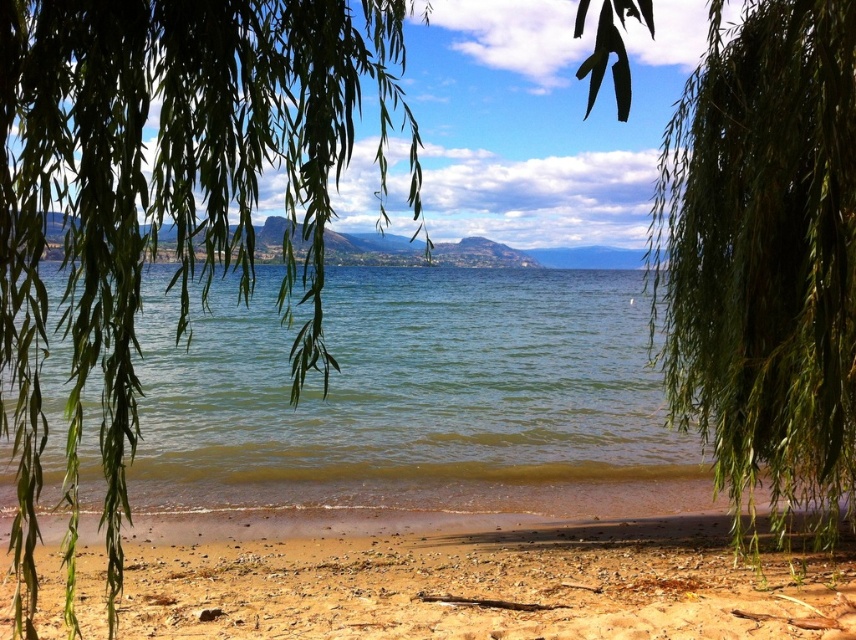
Does green leafy tree at center appear under green leafy branch at center?

No, green leafy tree at center is not below green leafy branch at center.

Who is more forward, (94, 204) or (715, 301)?

Point (94, 204) is in front.

I want to click on green leafy tree at center, so click(x=162, y=196).

Does green leafy branch at center lie behind brown sandy beach at lower center?

No, green leafy branch at center is closer to the viewer.

Is point (785, 163) closer to camera compared to point (681, 564)?

Yes, it is in front of point (681, 564).

What are the coordinates of `green leafy branch at center` in the screenshot? It's located at click(765, 257).

Looking at this image, who is more distant from viewer, [411,12] or [617,586]?

The point [411,12] is behind.

Is point (318, 92) farther from camera compared to point (390, 566)?

That is False.

Identify the location of green leafy tree at center. (162, 196).